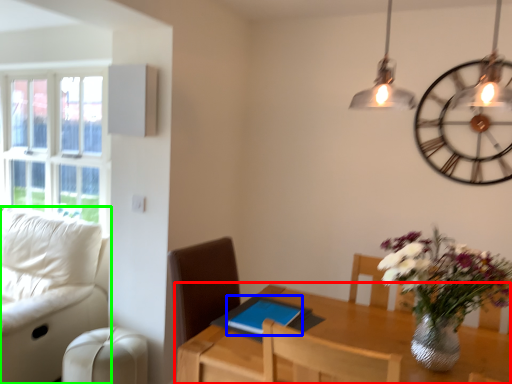
Question: Which is nearer to the table (highlighted by a red box)? tablet computer (highlighted by a blue box) or studio couch (highlighted by a green box).

Choices:
 (A) tablet computer
 (B) studio couch

Answer: (A)